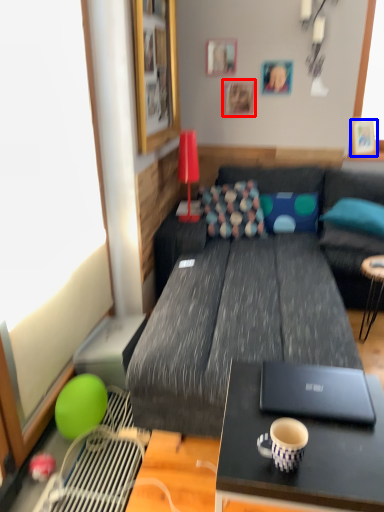
Question: Which point is closer to the camera, picture frame (highlighted by a red box) or picture frame (highlighted by a blue box)?

Choices:
 (A) picture frame
 (B) picture frame

Answer: (B)